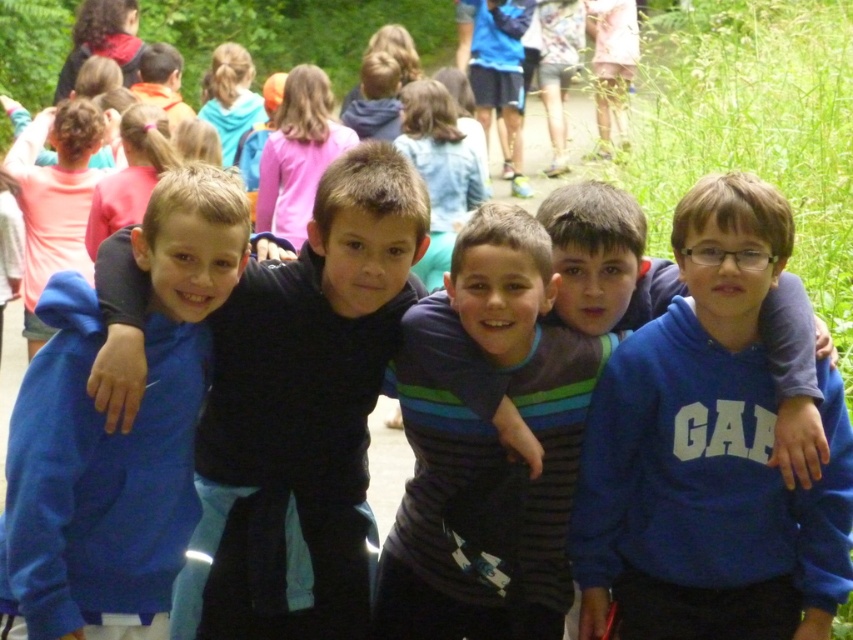
Can you confirm if dark blue hoodie at center is bigger than blue fleece jacket at center?

Yes, dark blue hoodie at center is bigger than blue fleece jacket at center.

Identify the location of dark blue hoodie at center. The height and width of the screenshot is (640, 853). (305, 410).

Is point (236, 321) positioned before point (74, 314)?

No, it is not.

This screenshot has height=640, width=853. Find the location of `dark blue hoodie at center`. dark blue hoodie at center is located at coordinates (305, 410).

Which is behind, point (704, 440) or point (399, 214)?

Positioned behind is point (704, 440).

How far apart are blue fleece sweatshirt at center and dark blue hoodie at center?

blue fleece sweatshirt at center is 1.34 meters away from dark blue hoodie at center.

You are a GUI agent. You are given a task and a screenshot of the screen. Output one action in this format:
    pyautogui.click(x=<x>, y=<y>)
    Task: Click on the blue fleece sweatshirt at center
    
    Given the screenshot: What is the action you would take?
    pyautogui.click(x=709, y=452)

Which is more to the right, blue fleece sweatshirt at center or blue fleece jacket at center?

Positioned to the right is blue fleece sweatshirt at center.

Who is taller, blue fleece sweatshirt at center or blue fleece jacket at center?

Standing taller between the two is blue fleece sweatshirt at center.

Describe the element at coordinates (709, 452) in the screenshot. I see `blue fleece sweatshirt at center` at that location.

Identify the location of blue fleece sweatshirt at center. The image size is (853, 640). (709, 452).